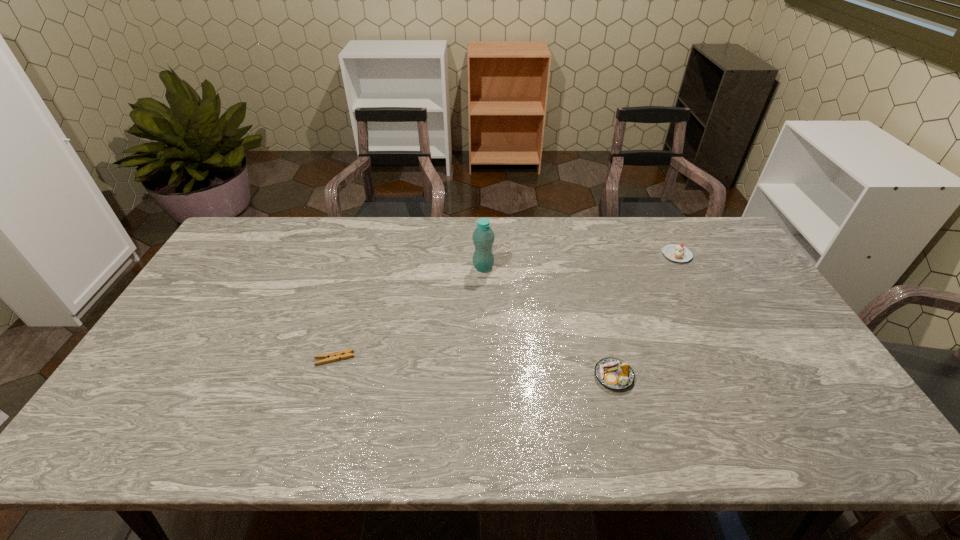
The width and height of the screenshot is (960, 540). Find the location of `water bottle`. water bottle is located at coordinates (483, 237).

Locate an element on the screen. the tallest object is located at coordinates tap(483, 237).

Image resolution: width=960 pixels, height=540 pixels. In order to click on cupcake in this screenshot , I will do `click(675, 252)`.

You are a GUI agent. You are given a task and a screenshot of the screen. Output one action in this format:
    pyautogui.click(x=<x>, y=<y>)
    Task: Click on the pastry
    Image resolution: width=960 pixels, height=540 pixels.
    Given the screenshot: What is the action you would take?
    pyautogui.click(x=613, y=373)

Where is `clothespin`? This screenshot has height=540, width=960. clothespin is located at coordinates (344, 354).

Find the location of a particular element. Image resolution: width=960 pixels, height=540 pixels. the shortest object is located at coordinates (344, 354).

Where is `free space located at the front cap of the water bottle`? free space located at the front cap of the water bottle is located at coordinates (484, 285).

Find the location of `vacant space located on the front of the cupcake`. vacant space located on the front of the cupcake is located at coordinates (702, 303).

The image size is (960, 540). I want to click on free region located 0.050m on the back of the pastry, so click(606, 346).

Where is `vacant space situated 0.290m on the back of the shortest object`? This screenshot has height=540, width=960. vacant space situated 0.290m on the back of the shortest object is located at coordinates (359, 279).